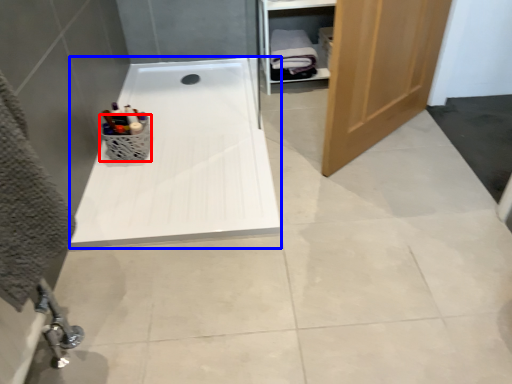
Question: Which object is closer to the camera taking this photo, basket (highlighted by a red box) or bath (highlighted by a blue box)?

Choices:
 (A) basket
 (B) bath

Answer: (B)